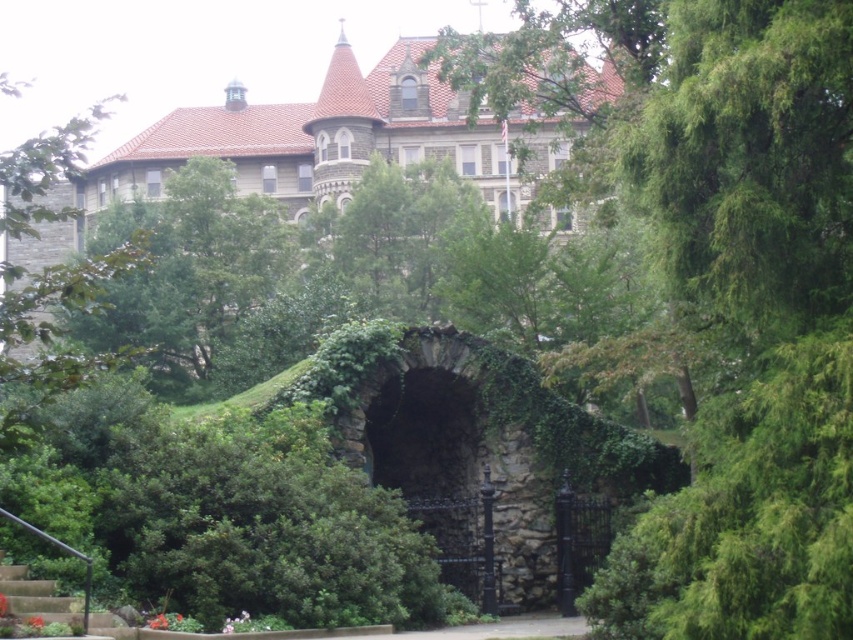
Question: Based on their relative distances, which object is nearer to the rustic stone archway at center?

Choices:
 (A) green leafy tree at center
 (B) gray stone castle at upper center
 (C) concrete stairs at lower left

Answer: (A)

Question: Does rustic stone archway at center appear over concrete stairs at lower left?

Choices:
 (A) no
 (B) yes

Answer: (B)

Question: In this image, where is gray stone castle at upper center located relative to rustic stone archway at center?

Choices:
 (A) right
 (B) left

Answer: (B)

Question: Which point is farther from the camera taking this photo?

Choices:
 (A) (262, 163)
 (B) (474, 497)
 (C) (827, 44)
 (D) (64, 605)

Answer: (A)

Question: Does green leafy tree at center lie behind concrete stairs at lower left?

Choices:
 (A) yes
 (B) no

Answer: (B)

Question: Which of the following is the farthest from the observer?

Choices:
 (A) (434, 449)
 (B) (486, 36)

Answer: (B)